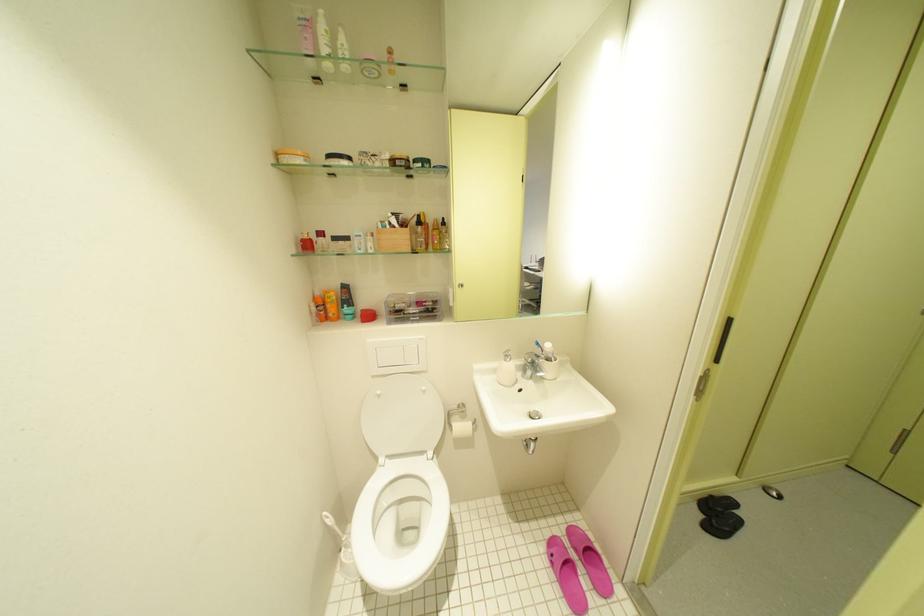
This screenshot has height=616, width=924. I want to click on toilet flush button, so click(x=396, y=355).